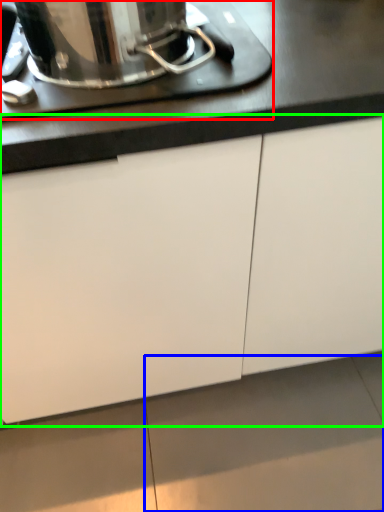
Question: Which is nearer to the home appliance (highlighted by a red box)? tile (highlighted by a blue box) or cabinetry (highlighted by a green box).

Choices:
 (A) tile
 (B) cabinetry

Answer: (B)